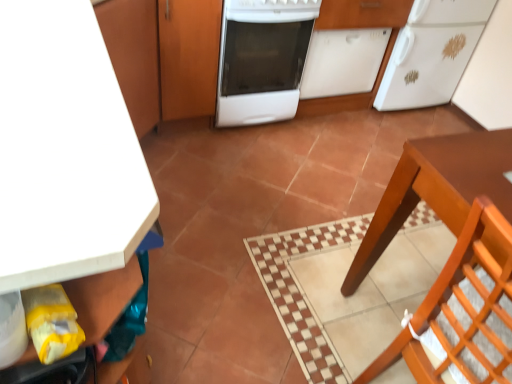
What are the coordinates of `free region on the left part of brown wooden table at lower right` in the screenshot? It's located at (301, 271).